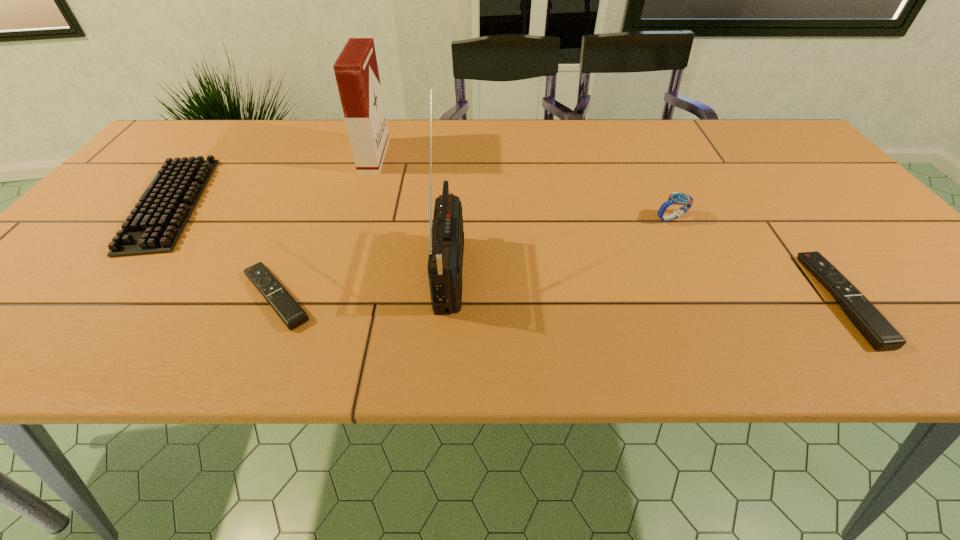
You are a GUI agent. You are given a task and a screenshot of the screen. Output one action in this format:
    pyautogui.click(x=<x>, y=<y>)
    Task: Click on the vacant spot for a new remote_control to ensure equal spacing
    This screenshot has width=960, height=540.
    Given the screenshot: What is the action you would take?
    coord(558,298)